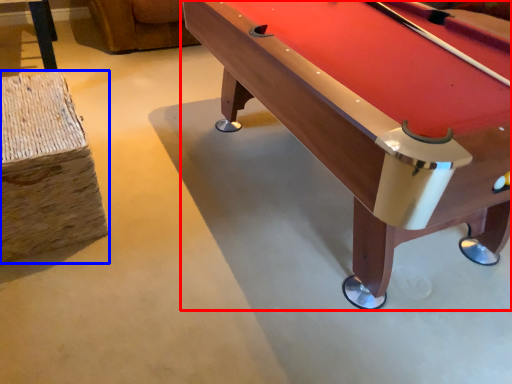
Question: Which of the following is the closest to the observer, billiard table (highlighted by a red box) or bar stool (highlighted by a blue box)?

Choices:
 (A) billiard table
 (B) bar stool

Answer: (A)